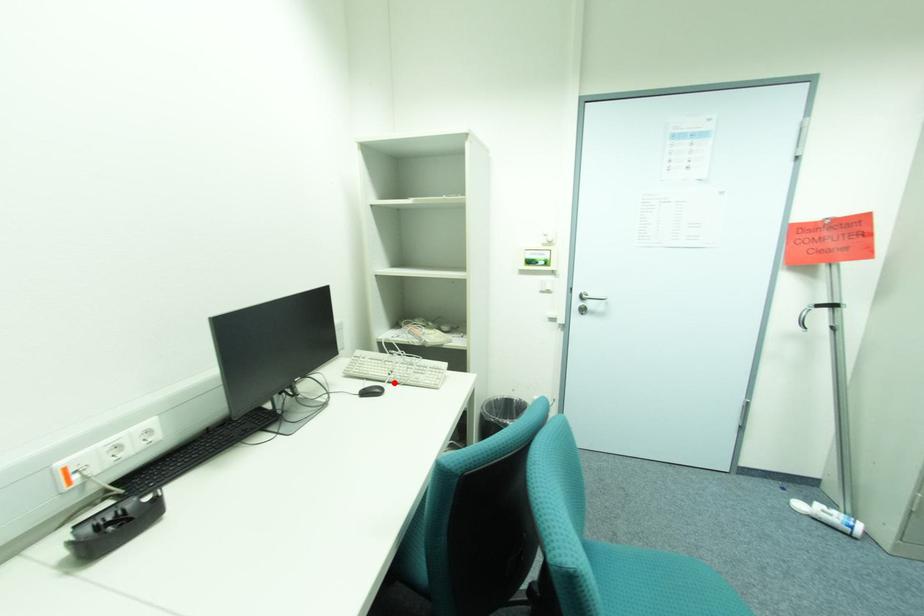
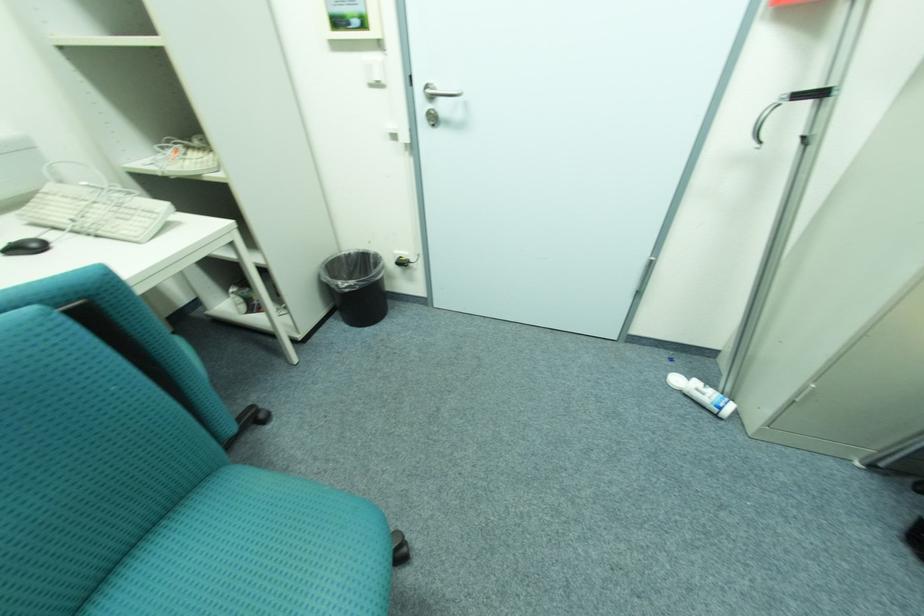
Locate, in the second image, the point that corresponds to the highlighted location in the first image.

(81, 233)